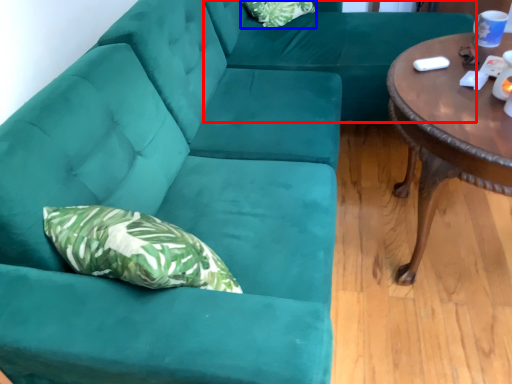
Question: Among these objects, which one is nearest to the camera, couch (highlighted by a red box) or pillow (highlighted by a blue box)?

Choices:
 (A) couch
 (B) pillow

Answer: (A)